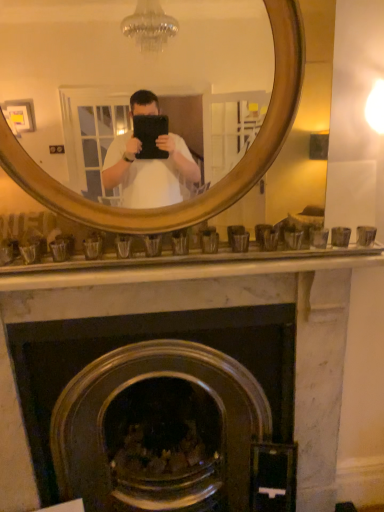
Question: In terms of width, does wooden mirror at upper center look wider or thinner when compared to marble fireplace at center?

Choices:
 (A) wide
 (B) thin

Answer: (B)

Question: Considering the positions of wooden mirror at upper center and marble fireplace at center in the image, is wooden mirror at upper center taller or shorter than marble fireplace at center?

Choices:
 (A) short
 (B) tall

Answer: (A)

Question: Would you say wooden mirror at upper center is inside or outside marble fireplace at center?

Choices:
 (A) outside
 (B) inside

Answer: (A)

Question: In terms of width, does marble fireplace at center look wider or thinner when compared to wooden mirror at upper center?

Choices:
 (A) thin
 (B) wide

Answer: (B)

Question: Considering the relative positions of marble fireplace at center and wooden mirror at upper center in the image provided, is marble fireplace at center to the left or to the right of wooden mirror at upper center?

Choices:
 (A) right
 (B) left

Answer: (B)

Question: Considering their positions, is marble fireplace at center located in front of or behind wooden mirror at upper center?

Choices:
 (A) front
 (B) behind

Answer: (B)

Question: Is marble fireplace at center inside or outside of wooden mirror at upper center?

Choices:
 (A) outside
 (B) inside

Answer: (A)